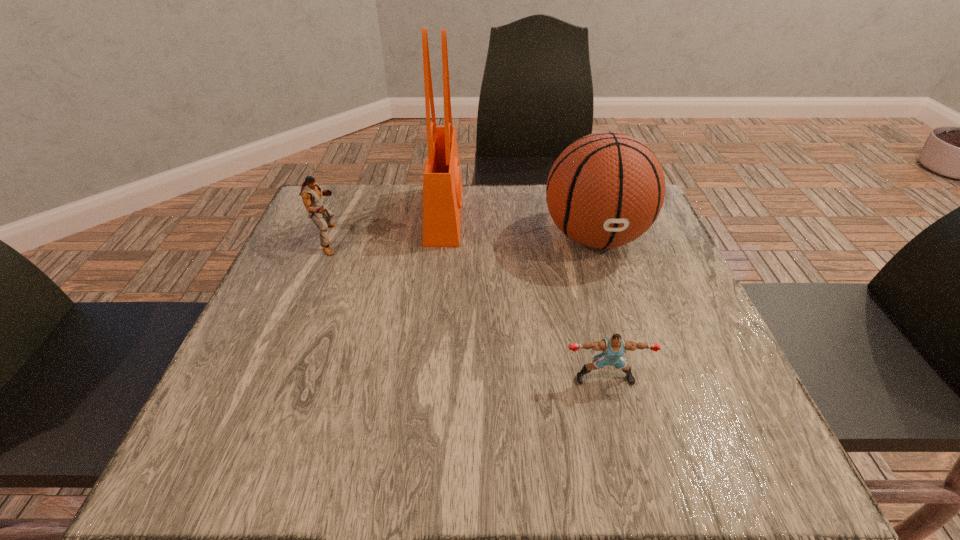
Locate an element on the screen. This screenshot has width=960, height=540. vacant region located 0.120m on the front-facing side of the shorter puncher is located at coordinates (623, 453).

The image size is (960, 540). Find the location of `tote bag that is at the far edge`. tote bag that is at the far edge is located at coordinates click(442, 185).

Where is `basketball located in the far edge section of the desktop`? The image size is (960, 540). basketball located in the far edge section of the desktop is located at coordinates (606, 189).

This screenshot has height=540, width=960. What are the coordinates of `puncher at the far edge` in the screenshot? It's located at (311, 193).

Locate an element on the screen. object positioned at the left edge is located at coordinates [x=311, y=193].

Identify the location of basketball that is at the right edge. This screenshot has width=960, height=540. (606, 189).

Find the location of `puncher present at the right edge`. puncher present at the right edge is located at coordinates (614, 347).

You are a GUI agent. You are given a task and a screenshot of the screen. Output one action in this format:
    pyautogui.click(x=<x>, y=<y>)
    Task: Click on the object present at the far left corner
    Image resolution: width=960 pixels, height=540 pixels.
    Given the screenshot: What is the action you would take?
    pyautogui.click(x=311, y=193)

Image resolution: width=960 pixels, height=540 pixels. In order to click on object at the far right corner in this screenshot , I will do `click(606, 189)`.

I want to click on free location at the far edge, so click(x=482, y=213).